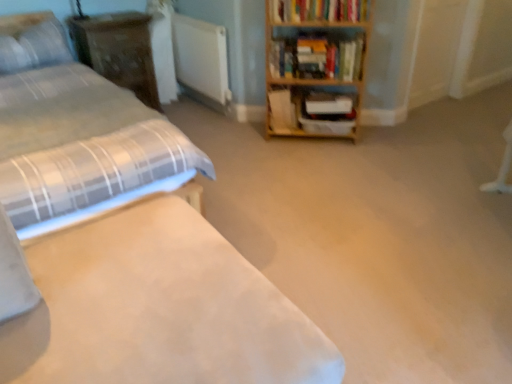
Locate an element on the screen. This screenshot has height=384, width=512. free space in front of wooden bookcase at upper right is located at coordinates (320, 164).